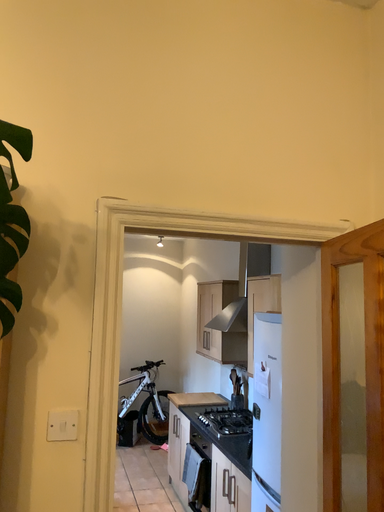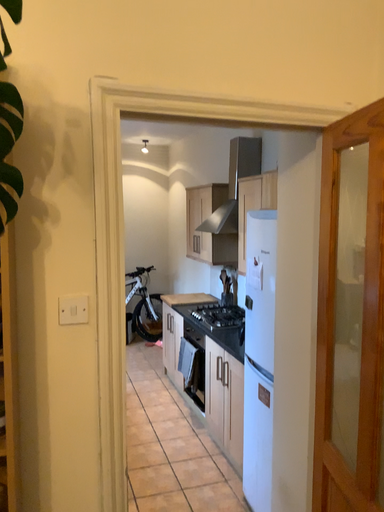
Question: Which way did the camera rotate in the video?

Choices:
 (A) rotated upward
 (B) rotated downward

Answer: (B)